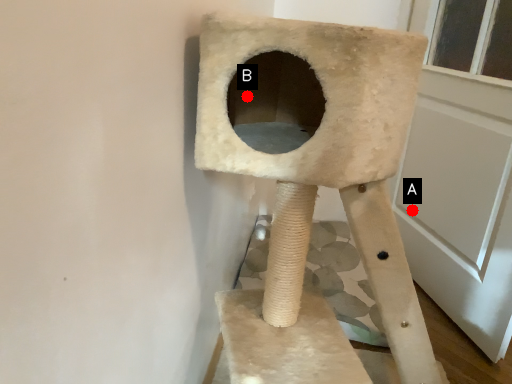
Question: Two points are circled on the image, labeled by A and B beside each circle. Among these points, which one is nearest to the camera?

Choices:
 (A) A is closer
 (B) B is closer

Answer: (B)